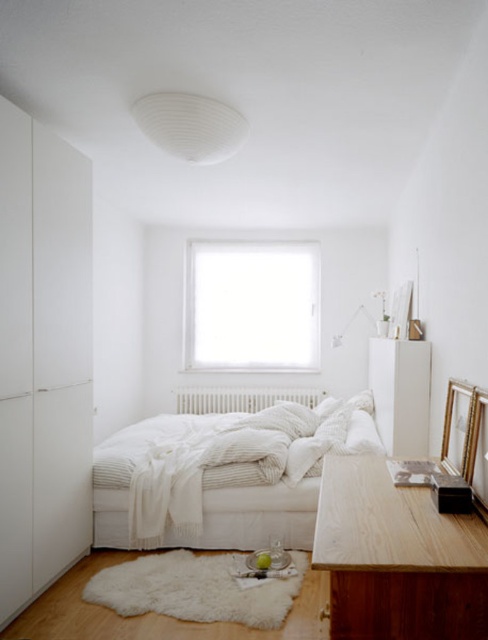
You are a houseplant that needs sunlight and are placed on the white soft bed at center. The white matte radiator at center is above you. Can you get enough sunlight from your current position?

The white soft bed at center is positioned under the white matte radiator at center, so the radiator is blocking sunlight from the window. Therefore, the houseplant cannot get enough sunlight from its current position.

You are standing in the minimalist bedroom and want to place a small plant on the desk. The desk is located at point (397,557). Can you confirm if there is enough space on the desk to place the plant?

The point (397,557) marks the natural wood desk at lower right, so yes, there is space to place the plant on the desk.

You are standing in the minimalist bedroom and want to move closer to both the point at coordinates point (x=361, y=538) and point (x=318, y=410). Which point will you reach first?

You will reach point (x=361, y=538) first because it is closer to you than point (x=318, y=410).